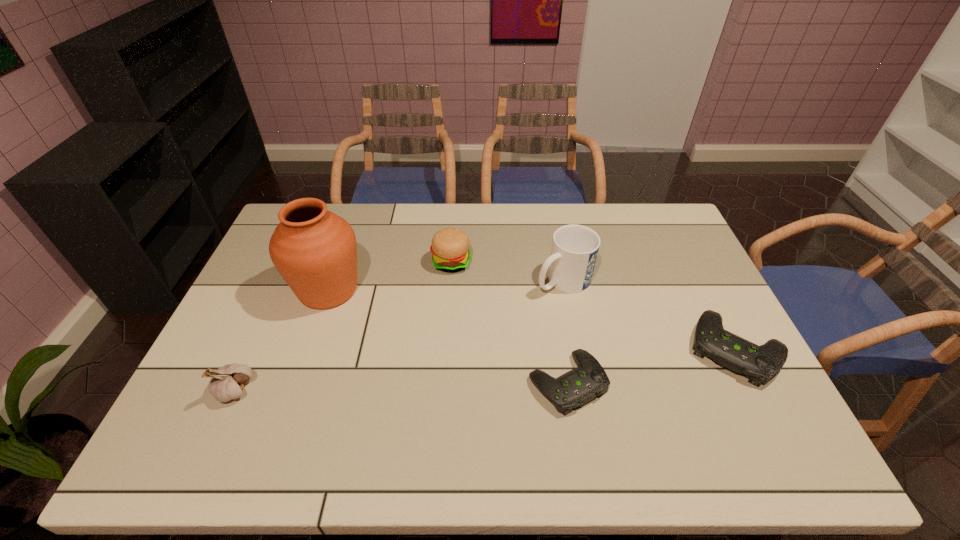
The height and width of the screenshot is (540, 960). In order to click on vacant region located on the front of the urn in this screenshot , I will do `click(283, 420)`.

In order to click on vacant area located 0.090m on the back of the mug in this screenshot , I will do `click(557, 246)`.

You are a GUI agent. You are given a task and a screenshot of the screen. Output one action in this format:
    pyautogui.click(x=<x>, y=<y>)
    Task: Click on the vacant area situated on the front of the hamburger
    
    Given the screenshot: What is the action you would take?
    point(447,315)

Find the location of `free space located 0.250m on the right of the garlic`. free space located 0.250m on the right of the garlic is located at coordinates (352, 390).

You are a GUI agent. You are given a task and a screenshot of the screen. Output one action in this format:
    pyautogui.click(x=<x>, y=<y>)
    Task: Click on the control positioned at the near edge
    
    Given the screenshot: What is the action you would take?
    pyautogui.click(x=576, y=387)

The image size is (960, 540). In order to click on garlic positioned at the near edge in this screenshot , I will do `click(227, 382)`.

The height and width of the screenshot is (540, 960). Find the location of `urn at the left edge`. urn at the left edge is located at coordinates (315, 251).

You are a GUI agent. You are given a task and a screenshot of the screen. Output one action in this format:
    pyautogui.click(x=<x>, y=<y>)
    Task: Click on the garlic at the left edge
    The width and height of the screenshot is (960, 540).
    Given the screenshot: What is the action you would take?
    pyautogui.click(x=227, y=382)

I want to click on object that is at the right edge, so click(x=758, y=363).

Identify the location of object situated at the near left corner. (227, 382).